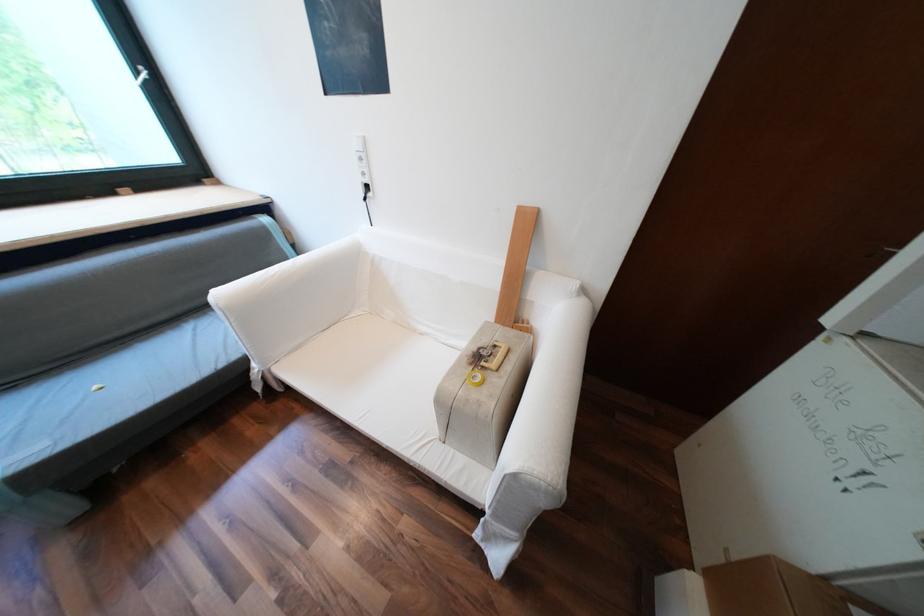
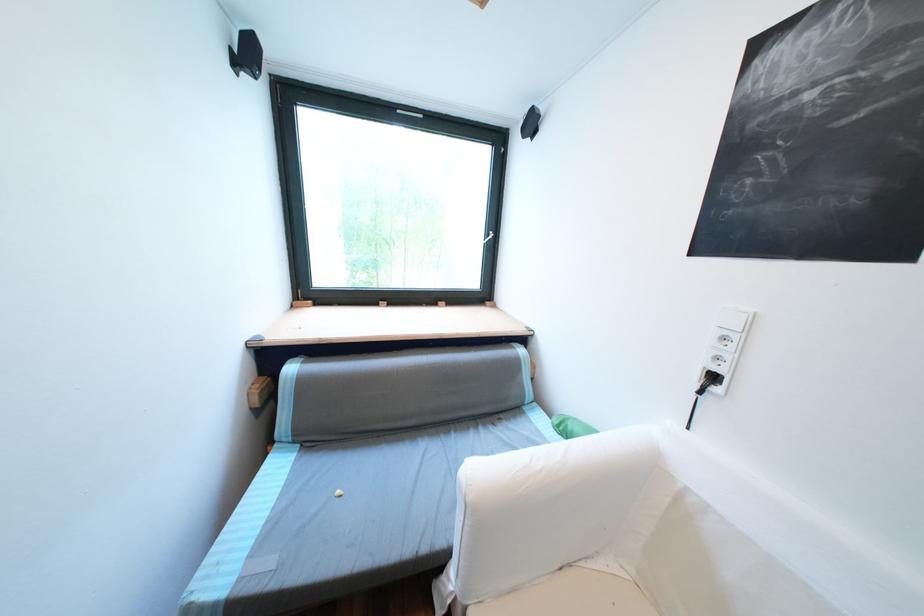
Locate, in the second image, the point that corresponds to pixel 379 193 in the first image.

(725, 390)